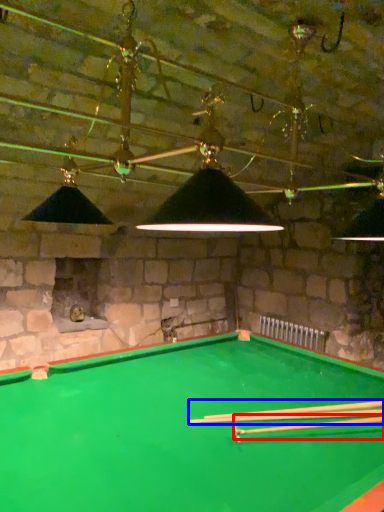
Question: Which object is further to the camera taking this photo, cue (highlighted by a red box) or cue (highlighted by a blue box)?

Choices:
 (A) cue
 (B) cue

Answer: (B)